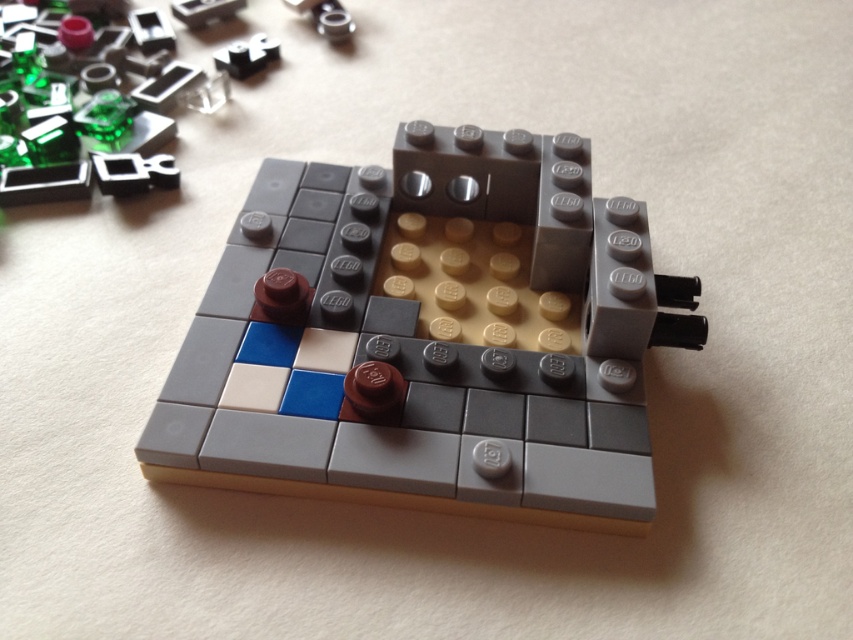
You are an architect designing a miniature LEGO city. You have two elements in front of you, the matte gray lego structure at center and the transparent green plastic at upper left. Which of these two objects is wider when viewed from above?

The matte gray lego structure at center is wider than the transparent green plastic at upper left.

You are a child trying to reach both the matte gray lego structure at center and the transparent green plastic at upper left from your current position. Which object will require you to move forward more to reach?

The transparent green plastic at upper left is further away from you than the matte gray lego structure at center, so you will need to move forward more to reach it.